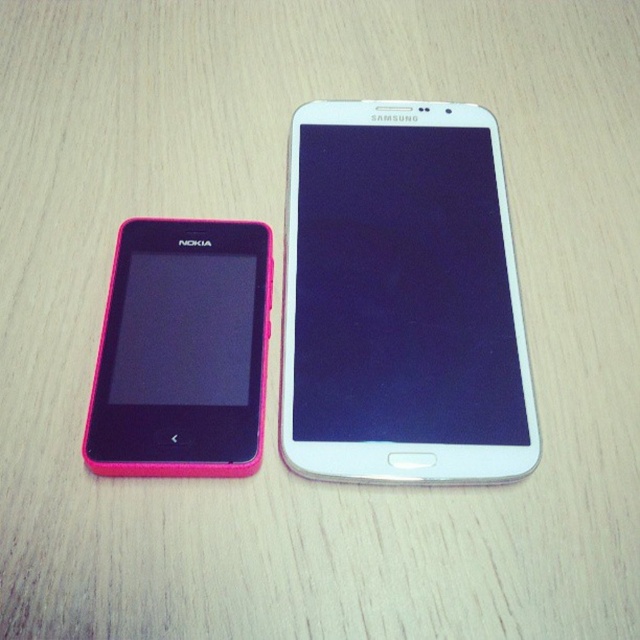
Question: Can you confirm if white glossy smartphone at center is thinner than pink plastic nokia phone at left?

Choices:
 (A) yes
 (B) no

Answer: (B)

Question: Is white glossy smartphone at center below pink plastic nokia phone at left?

Choices:
 (A) no
 (B) yes

Answer: (A)

Question: Does white glossy smartphone at center have a larger size compared to pink plastic nokia phone at left?

Choices:
 (A) yes
 (B) no

Answer: (A)

Question: Among these objects, which one is nearest to the camera?

Choices:
 (A) white glossy smartphone at center
 (B) pink plastic nokia phone at left

Answer: (B)